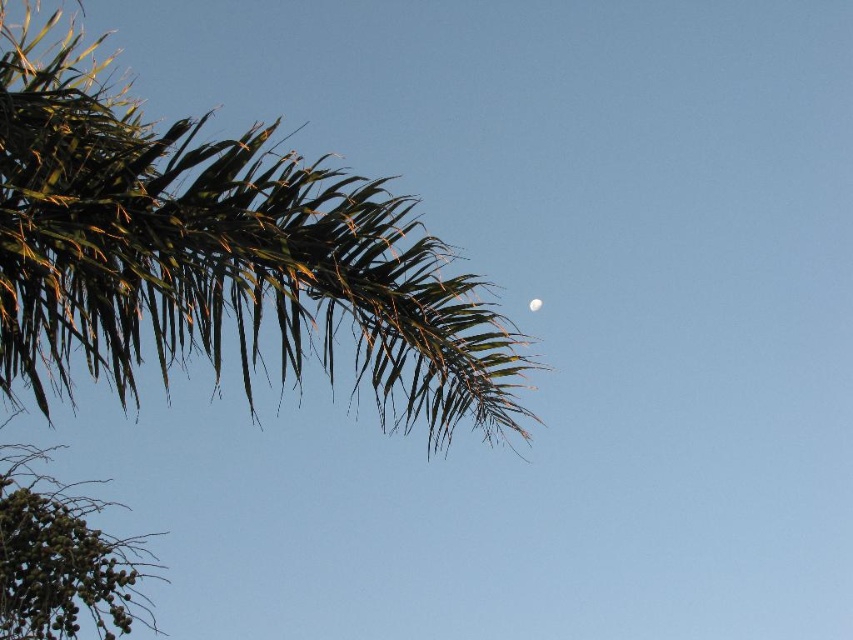
You are an astronomer observing the sky and notice the green leafy palm at upper left and the white glossy moon at upper center. Which object is positioned more to the left side of the sky?

The green leafy palm at upper left is positioned more to the left side of the sky than the white glossy moon at upper center.

You are an astronaut floating in space looking at the Earth. You see the green leafy palm at upper left and the white glossy moon at upper center. Which object is closer to you?

The green leafy palm at upper left is closer to you because it is in front of the white glossy moon at upper center.

You are an astronomer observing the sky. You notice two points of light in the sky, one at point (97, 211) and another at point (537, 301). Which point is closer to you?

Point (97, 211) is in front of point (537, 301), so it is closer to you.